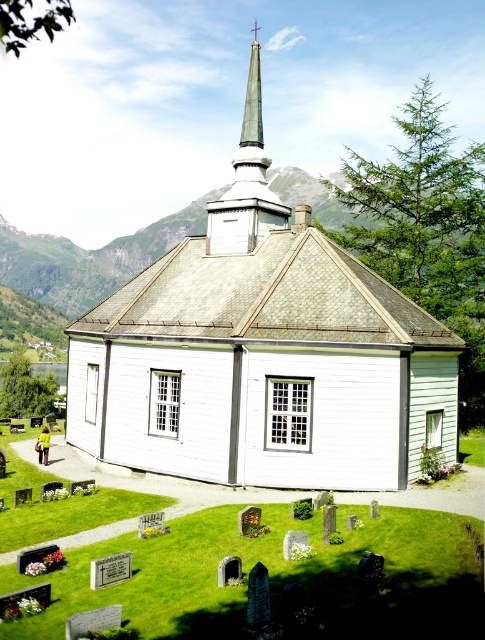
You are standing in the graveyard looking towards the church. Which object takes up more visual space in the image, the white wood church at center or the green polished stone spire at upper center?

The green polished stone spire at upper center takes up more visual space in the image than the white wood church at center.

Based on the scene description and the provided coordinates, can you identify the object located at point (261, 355)?

The point (261, 355) indicates the white wood church at center.

You are standing in front of the white wooden church and want to walk towards the two points marked in the image. Which point, point (453, 371) or point (247, 243), will you reach first?

Result: Point (453, 371) is closer to the viewer than point (247, 243), so you will reach point (453, 371) first.